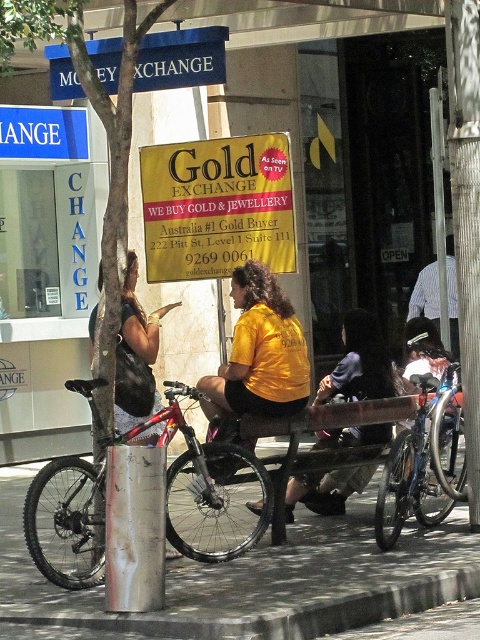
You are standing in front of the Gold Exchange sign on 222 Pitt St. You notice two points marked on the sign. The first point is at coordinate (171, 524) and the second point is at (108, 204). Which point is closer to you?

Point (108, 204) is closer to you because it is in front of point (171, 524).